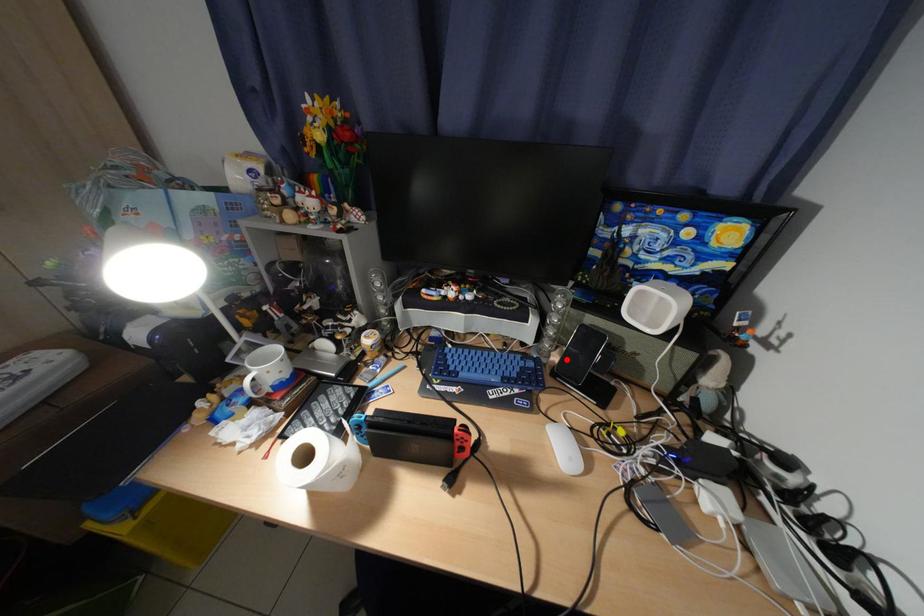
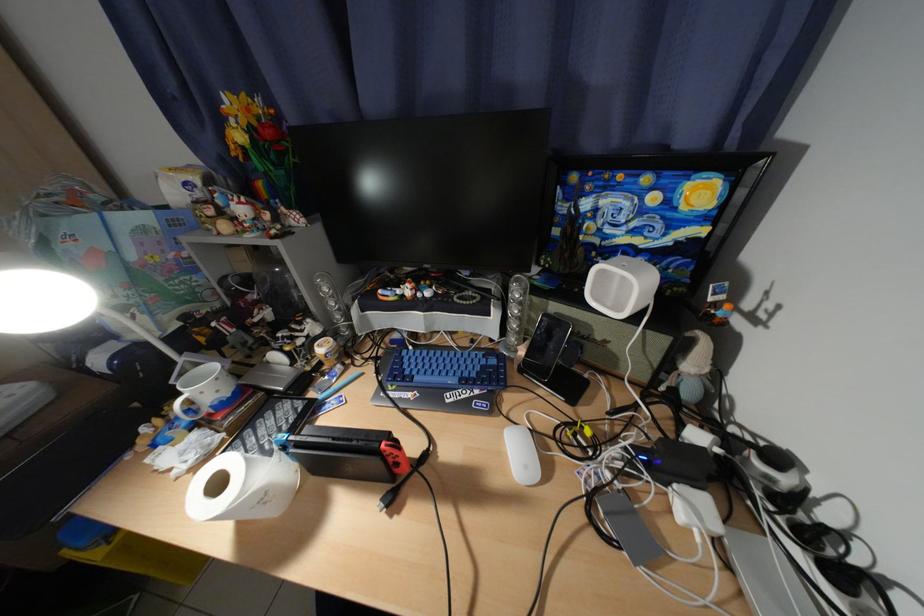
The point at the highlighted location is marked in the first image. Where is the corresponding point in the second image?

(533, 354)